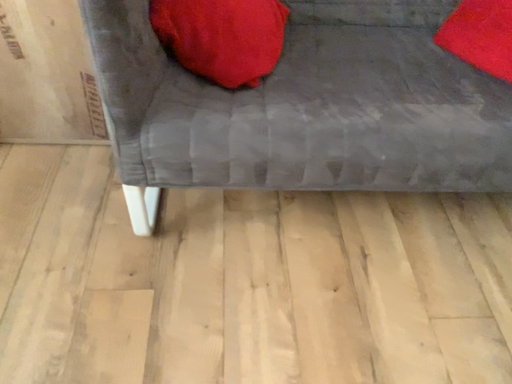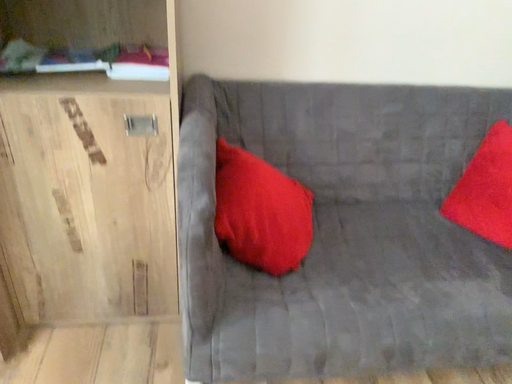
Question: Which way did the camera rotate in the video?

Choices:
 (A) rotated downward
 (B) rotated upward

Answer: (B)